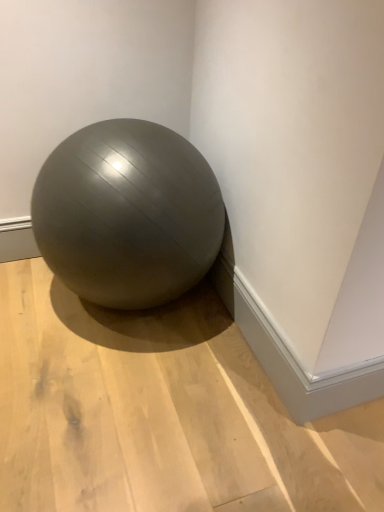
Measure the distance between point (139, 434) and camera.

Point (139, 434) and camera are 3.88 feet apart.

The height and width of the screenshot is (512, 384). What do you see at coordinates (160, 413) in the screenshot? I see `matte gray ball at center` at bounding box center [160, 413].

Where is `matte gray ball at center`? Image resolution: width=384 pixels, height=512 pixels. matte gray ball at center is located at coordinates (160, 413).

Describe the element at coordinates (127, 214) in the screenshot. I see `satin gray ball at center` at that location.

In order to face satin gray ball at center, should I rotate leftwards or rightwards?

You should look left and rotate roughly 9.072 degrees.

Identify the location of satin gray ball at center. This screenshot has width=384, height=512. (127, 214).

What is the approximate width of satin gray ball at center?

satin gray ball at center is 22.68 inches wide.

The height and width of the screenshot is (512, 384). I want to click on matte gray ball at center, so click(x=160, y=413).

Is matte gray ball at center at the right side of satin gray ball at center?

Correct, you'll find matte gray ball at center to the right of satin gray ball at center.

Based on the photo, between matte gray ball at center and satin gray ball at center, which one is positioned behind?

Positioned behind is satin gray ball at center.

Does point (181, 406) appear closer or farther from the camera than point (64, 254)?

Point (181, 406) is positioned closer to the camera compared to point (64, 254).

Looking at this image, from the image's perspective, which object appears higher, matte gray ball at center or satin gray ball at center?

satin gray ball at center.

From a real-world perspective, is matte gray ball at center positioned under satin gray ball at center based on gravity?

Yes, from a real-world perspective, matte gray ball at center is beneath satin gray ball at center.

Considering the relative sizes of matte gray ball at center and satin gray ball at center in the image provided, is matte gray ball at center wider than satin gray ball at center?

Yes.

Considering the sizes of objects matte gray ball at center and satin gray ball at center in the image provided, who is taller, matte gray ball at center or satin gray ball at center?

Standing taller between the two is satin gray ball at center.

Can you confirm if matte gray ball at center is smaller than satin gray ball at center?

Yes.

Could satin gray ball at center be considered to be inside matte gray ball at center?

Definitely not — satin gray ball at center is not inside matte gray ball at center.

Is matte gray ball at center positioned far away from satin gray ball at center?

No, matte gray ball at center is not far away from satin gray ball at center.

Is matte gray ball at center oriented towards satin gray ball at center?

No.

How many degrees apart are the facing directions of matte gray ball at center and satin gray ball at center?

1.3 degrees.

Where is `ball above the matte gray ball at center (from the image's perspective)`? ball above the matte gray ball at center (from the image's perspective) is located at coordinates (127, 214).

Which object is positioned more to the left, satin gray ball at center or matte gray ball at center?

From the viewer's perspective, satin gray ball at center appears more on the left side.

In the image, is satin gray ball at center positioned in front of or behind matte gray ball at center?

satin gray ball at center is positioned farther from the viewer than matte gray ball at center.

Considering the positions of points (136, 203) and (125, 366), is point (136, 203) closer to camera compared to point (125, 366)?

Yes.

From the image's perspective, is satin gray ball at center below matte gray ball at center?

No, from the image's perspective, satin gray ball at center is not below matte gray ball at center.

From a real-world perspective, is satin gray ball at center beneath matte gray ball at center?

No.

Which of these two, satin gray ball at center or matte gray ball at center, is wider?

matte gray ball at center.

Looking at this image, can you confirm if satin gray ball at center is taller than matte gray ball at center?

Correct, satin gray ball at center is much taller as matte gray ball at center.

Is satin gray ball at center smaller than matte gray ball at center?

Incorrect, satin gray ball at center is not smaller in size than matte gray ball at center.

Is matte gray ball at center located within satin gray ball at center?

No, satin gray ball at center does not contain matte gray ball at center.

Is satin gray ball at center directly adjacent to matte gray ball at center?

No, satin gray ball at center is not touching matte gray ball at center.

Consider the image. Is satin gray ball at center facing towards matte gray ball at center?

Yes, satin gray ball at center is turned towards matte gray ball at center.

What's the angular difference between satin gray ball at center and matte gray ball at center's facing directions?

1.3 degrees separate the facing orientations of satin gray ball at center and matte gray ball at center.

This screenshot has width=384, height=512. I want to click on surface that appears on the right of satin gray ball at center, so click(160, 413).

Image resolution: width=384 pixels, height=512 pixels. Identify the location of ball located on the left of matte gray ball at center. (127, 214).

This screenshot has height=512, width=384. In order to click on surface that appears below the satin gray ball at center (from a real-world perspective) in this screenshot , I will do `click(160, 413)`.